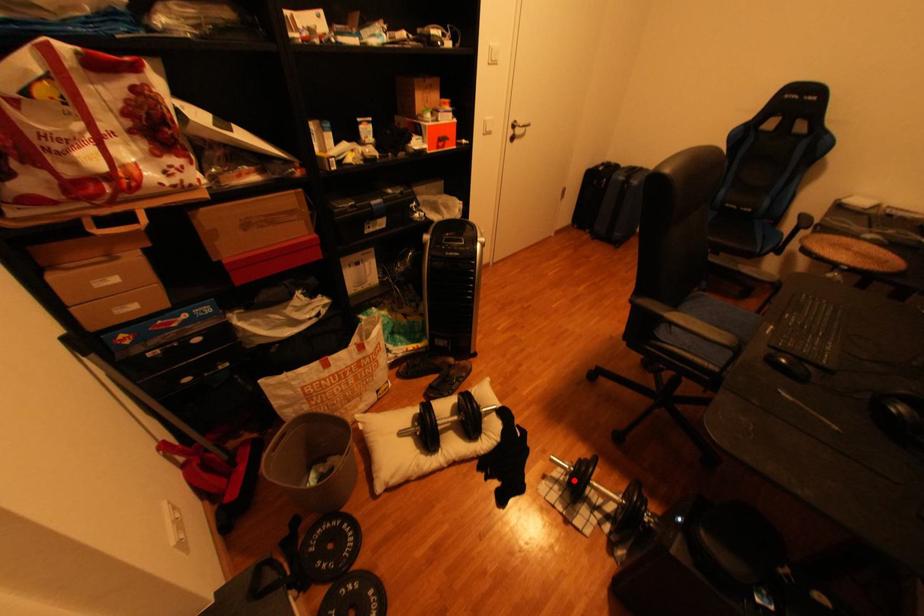
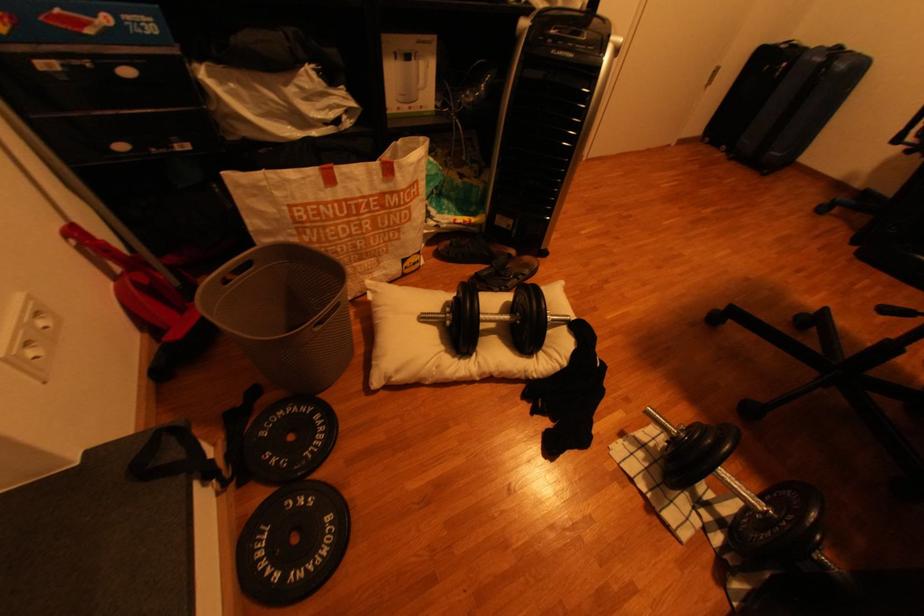
In the second image, find the point that corresponds to the highlighted location in the first image.

(665, 446)